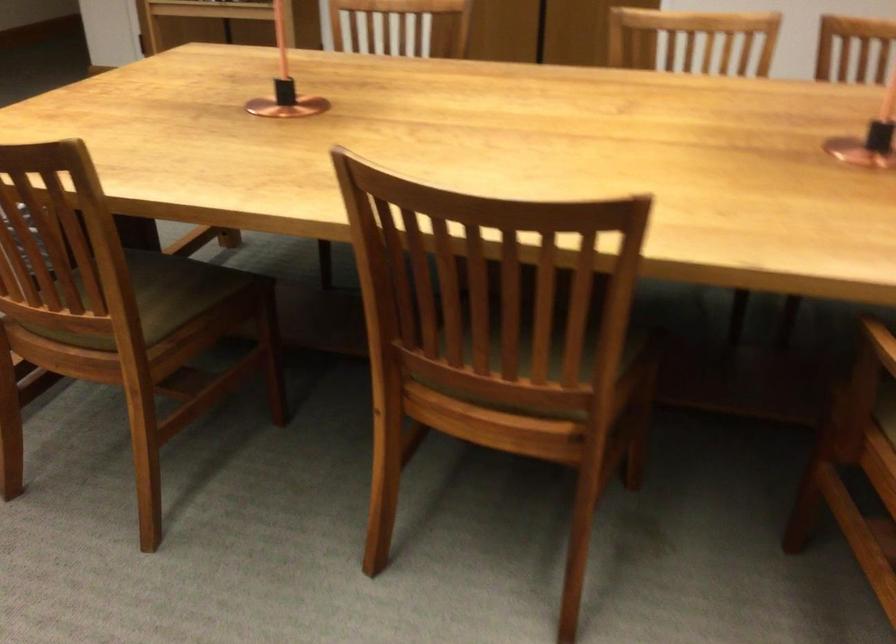
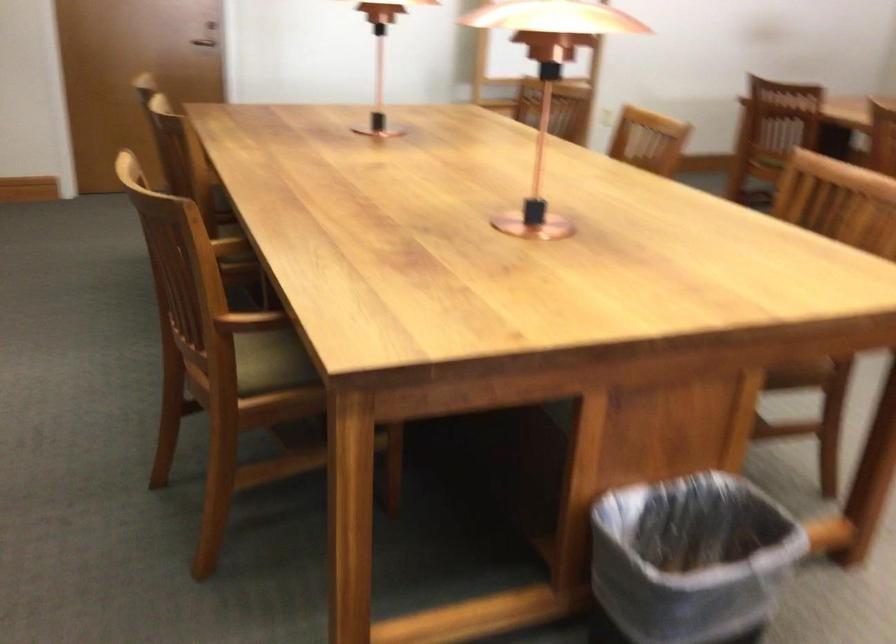
Question: I am providing you with two images of the same scene from different viewpoints. Please identify which objects are invisible in image2.

Choices:
 (A) trash can
 (B) green chair sitting surface
 (C) small white notepad
 (D) door handle

Answer: (B)